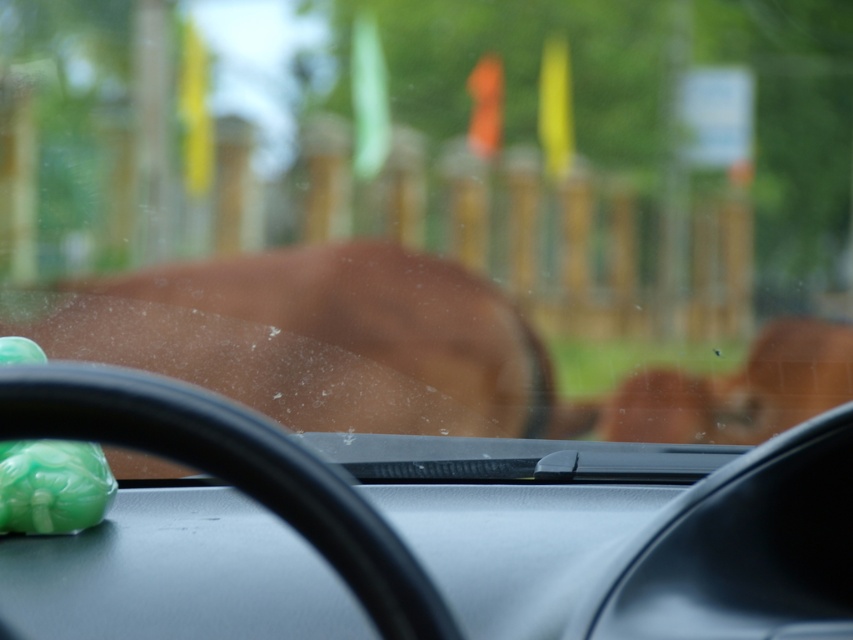
Question: Which point is farther from the camera taking this photo?

Choices:
 (A) (106, 496)
 (B) (361, 304)

Answer: (B)

Question: Is brown matte animal at center to the right of green jade ornament at lower left from the viewer's perspective?

Choices:
 (A) no
 (B) yes

Answer: (B)

Question: Which point appears farthest from the camera in this image?

Choices:
 (A) (105, 337)
 (B) (53, 486)

Answer: (A)

Question: Is brown matte animal at center below green jade ornament at lower left?

Choices:
 (A) yes
 (B) no

Answer: (B)

Question: Does brown matte animal at center appear over green jade ornament at lower left?

Choices:
 (A) no
 (B) yes

Answer: (B)